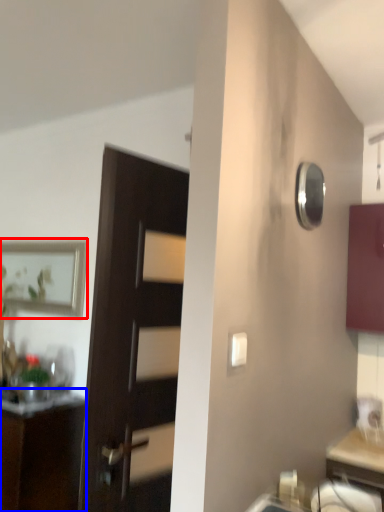
Question: Which point is further to the camera, picture frame (highlighted by a red box) or cabinetry (highlighted by a blue box)?

Choices:
 (A) picture frame
 (B) cabinetry

Answer: (A)